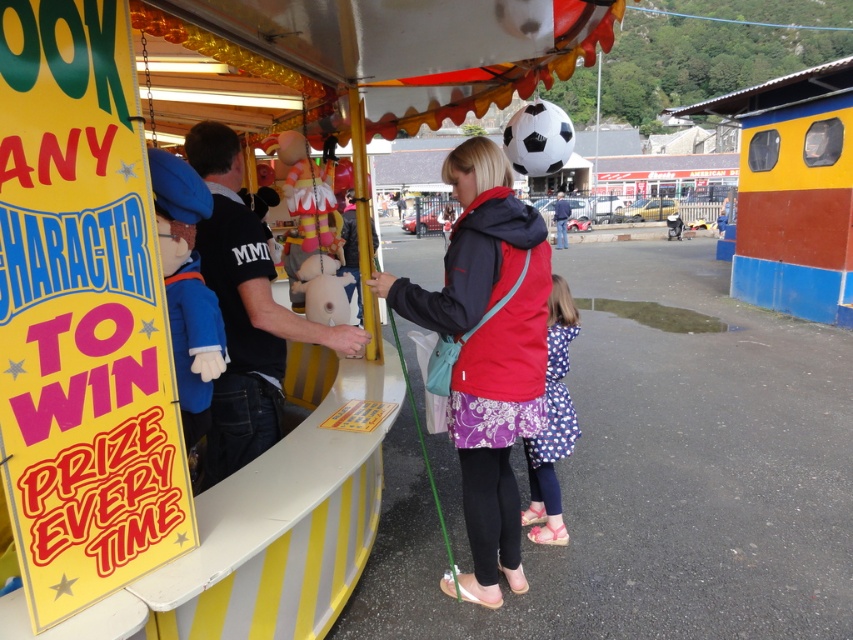
Question: Which object is farther from the camera taking this photo?

Choices:
 (A) blue plush toy at left
 (B) blue denim jacket at center

Answer: (B)

Question: Is red fleece jacket at center positioned in front of polka dot fabric dress at lower center?

Choices:
 (A) yes
 (B) no

Answer: (A)

Question: Does black matte shirt at center lie behind blue denim jacket at center?

Choices:
 (A) no
 (B) yes

Answer: (A)

Question: Which of these objects is positioned closest to the blue denim jacket at center?

Choices:
 (A) black matte shirt at center
 (B) polka dot fabric dress at lower center

Answer: (B)

Question: Which of the following is the closest to the observer?

Choices:
 (A) black matte shirt at center
 (B) polka dot fabric dress at lower center

Answer: (A)

Question: From the image, what is the correct spatial relationship of red fleece jacket at center in relation to blue plush toy at left?

Choices:
 (A) above
 (B) below

Answer: (B)